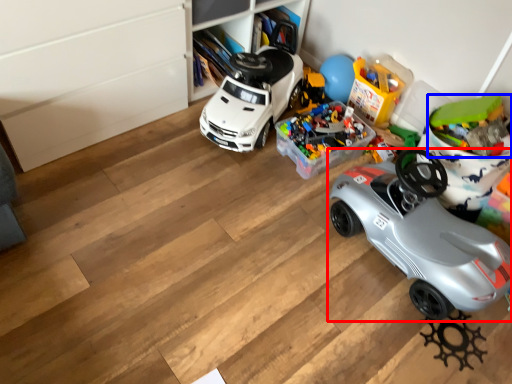
Question: Which object is further to the camera taking this photo, car (highlighted by a red box) or toy (highlighted by a blue box)?

Choices:
 (A) car
 (B) toy

Answer: (B)